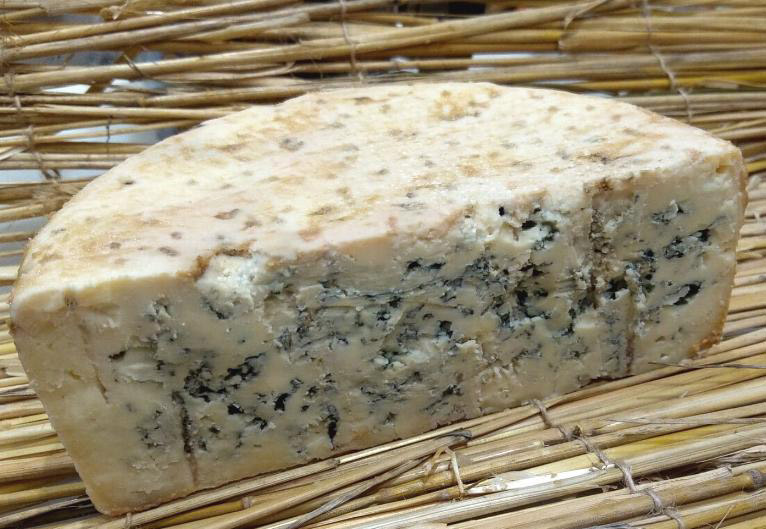
Where is `wicker basket`? The height and width of the screenshot is (529, 766). wicker basket is located at coordinates (244, 63).